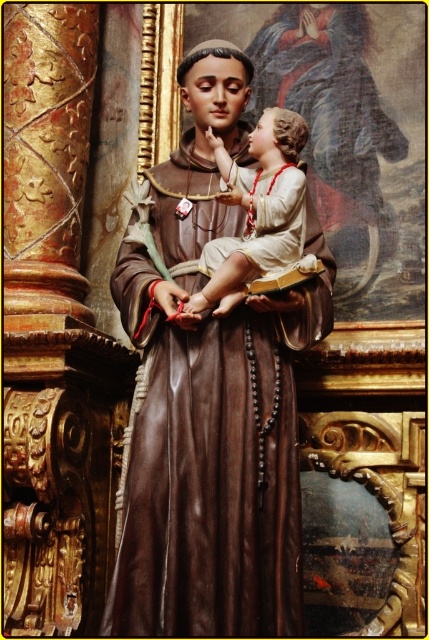
Is matte brown statue at center positioned at the back of smooth beige fabric at center?

No, matte brown statue at center is closer to the viewer.

Image resolution: width=429 pixels, height=640 pixels. Find the location of `matte brown statue at center`. matte brown statue at center is located at coordinates (211, 401).